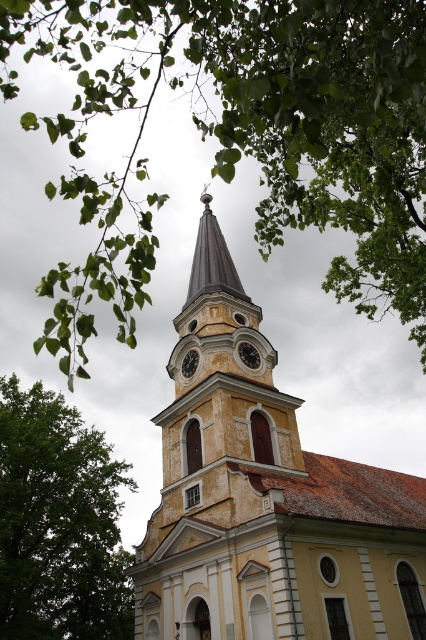
You are a photographer trying to capture the church in a photo. You notice the yellow weathered steeple at center and the metallic clock face at center. Which object should you focus on if you want to highlight the tallest element in your composition?

The yellow weathered steeple at center is taller than the metallic clock face at center, so focusing on it would highlight the tallest element in the composition.

You are a photographer wanting to capture the full height of both the green leafy tree at left and the dark gray metallic clock at center in a single shot. Based on the scene, which object will require you to adjust your camera angle upwards more to include its entire height in the photo?

The green leafy tree at left is taller than the dark gray metallic clock at center, so you will need to adjust your camera angle upwards more to include its entire height in the photo.

You are a photographer trying to capture the church steeple and clock in a single shot. Given that the yellow weathered steeple at center and dark gray metallic clock at center are both in your viewfinder, which object would appear wider in the photo?

The yellow weathered steeple at center would appear wider in the photo since its width surpasses that of the dark gray metallic clock at center.